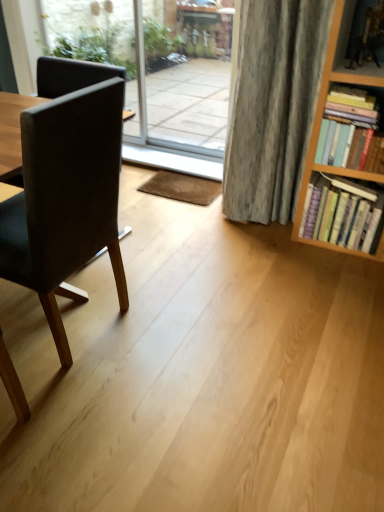
Where is `free space above hardcover books at right, the 1th book positioned from the top (from a real-world perspective)`? Image resolution: width=384 pixels, height=512 pixels. free space above hardcover books at right, the 1th book positioned from the top (from a real-world perspective) is located at coordinates (360, 90).